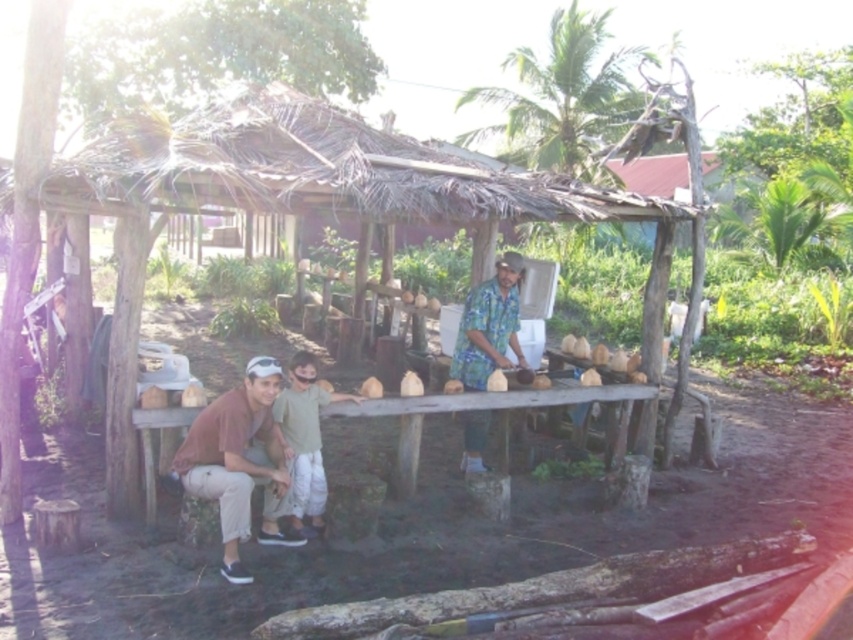
Question: Can you confirm if wooden table at lower left is positioned to the left of floral fabric shirt at center?

Choices:
 (A) yes
 (B) no

Answer: (B)

Question: Considering the relative positions of floral fabric shirt at center and light green cotton shirt at lower left in the image provided, where is floral fabric shirt at center located with respect to light green cotton shirt at lower left?

Choices:
 (A) below
 (B) above

Answer: (B)

Question: Which point is farther from the camera taking this photo?

Choices:
 (A) (399, 492)
 (B) (244, 481)

Answer: (A)

Question: Which point is closer to the camera?

Choices:
 (A) floral fabric shirt at center
 (B) light green cotton shirt at lower left
 (C) brown cotton shirt at lower left
 (D) wooden table at lower left

Answer: (C)

Question: Which object is positioned farthest from the floral fabric shirt at center?

Choices:
 (A) light green cotton shirt at lower left
 (B) brown cotton shirt at lower left
 (C) wooden table at lower left

Answer: (B)

Question: Does wooden table at lower left appear over floral fabric shirt at center?

Choices:
 (A) yes
 (B) no

Answer: (B)